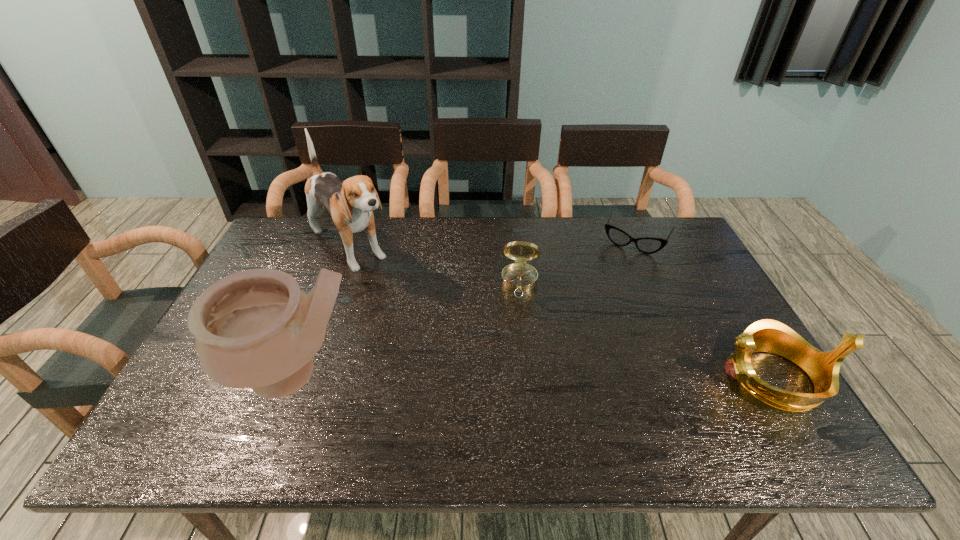
Locate an element on the screen. blank space that satisfies the following two spatial constraints: 1. on the front side of the spectacles; 2. at the front emblem of the tiara is located at coordinates (696, 378).

You are a GUI agent. You are given a task and a screenshot of the screen. Output one action in this format:
    pyautogui.click(x=<x>, y=<y>)
    Task: Click on the vacant space that satisfies the following two spatial constraints: 1. on the front side of the tiara; 2. at the front emblem of the shortest object
    This screenshot has height=540, width=960.
    Given the screenshot: What is the action you would take?
    point(696,378)

Image resolution: width=960 pixels, height=540 pixels. I want to click on free spot that satisfies the following two spatial constraints: 1. on the front side of the compass; 2. on the left side of the puppy, so click(x=337, y=282).